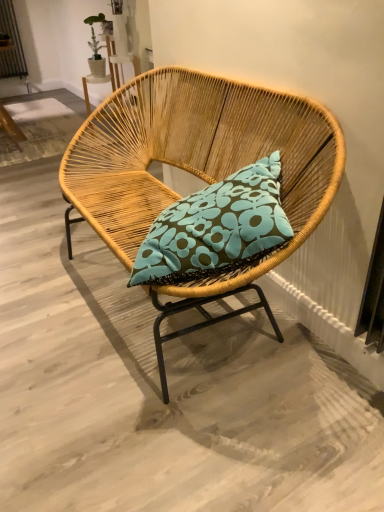
Question: Is woven wood chair at center far away from teal fabric pillow at center?

Choices:
 (A) yes
 (B) no

Answer: (B)

Question: Can you confirm if woven wood chair at center is positioned to the left of teal fabric pillow at center?

Choices:
 (A) yes
 (B) no

Answer: (A)

Question: From the image's perspective, would you say woven wood chair at center is positioned over teal fabric pillow at center?

Choices:
 (A) yes
 (B) no

Answer: (A)

Question: From the image's perspective, is woven wood chair at center below teal fabric pillow at center?

Choices:
 (A) no
 (B) yes

Answer: (A)

Question: Is the depth of woven wood chair at center less than that of teal fabric pillow at center?

Choices:
 (A) yes
 (B) no

Answer: (A)

Question: Is woven wood chair at center to the right of teal fabric pillow at center from the viewer's perspective?

Choices:
 (A) yes
 (B) no

Answer: (B)

Question: Is teal fabric pillow at center not inside woven wood chair at center?

Choices:
 (A) no
 (B) yes

Answer: (A)

Question: Is teal fabric pillow at center further to camera compared to woven wood chair at center?

Choices:
 (A) yes
 (B) no

Answer: (A)

Question: Is teal fabric pillow at center positioned far away from woven wood chair at center?

Choices:
 (A) no
 (B) yes

Answer: (A)

Question: From a real-world perspective, is teal fabric pillow at center positioned over woven wood chair at center based on gravity?

Choices:
 (A) yes
 (B) no

Answer: (A)

Question: Considering the relative sizes of teal fabric pillow at center and woven wood chair at center in the image provided, is teal fabric pillow at center taller than woven wood chair at center?

Choices:
 (A) no
 (B) yes

Answer: (A)

Question: Is teal fabric pillow at center in front of woven wood chair at center?

Choices:
 (A) no
 (B) yes

Answer: (A)

Question: Is teal fabric pillow at center bigger or smaller than woven wood chair at center?

Choices:
 (A) big
 (B) small

Answer: (B)